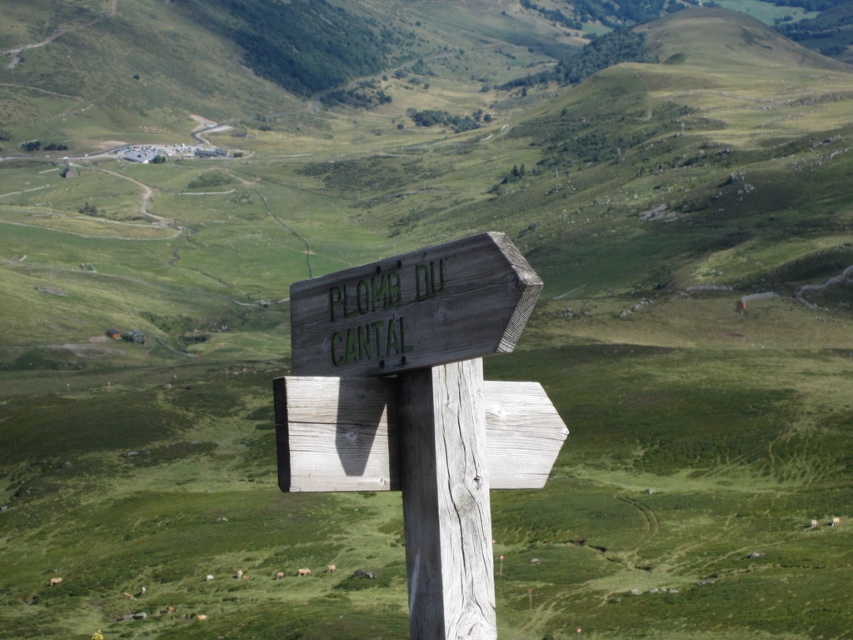
Question: From the image, what is the correct spatial relationship of wooden signpost at center in relation to weathered wood post at center?

Choices:
 (A) below
 (B) above

Answer: (B)

Question: Which point is farther to the camera?

Choices:
 (A) (418, 612)
 (B) (334, 352)
 (C) (318, 276)

Answer: (C)

Question: Which is farther from the green painted wood sign at center?

Choices:
 (A) weathered wood post at center
 (B) wooden signpost at center

Answer: (A)

Question: Is wooden signpost at center positioned before green painted wood sign at center?

Choices:
 (A) no
 (B) yes

Answer: (A)

Question: Is wooden signpost at center bigger than weathered wood post at center?

Choices:
 (A) yes
 (B) no

Answer: (A)

Question: Which object appears closest to the camera in this image?

Choices:
 (A) wooden signpost at center
 (B) green painted wood sign at center

Answer: (B)